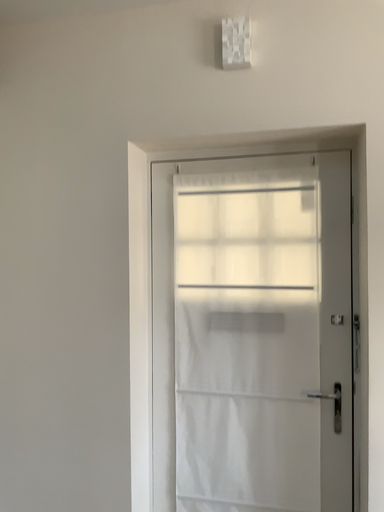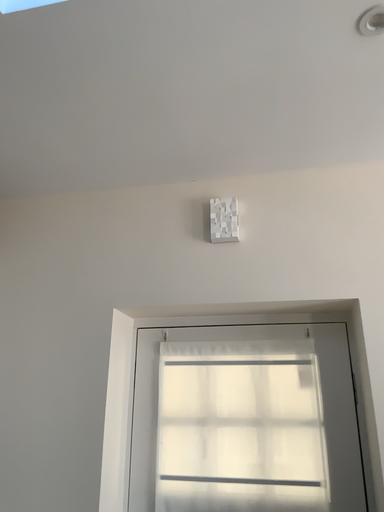
Question: How did the camera likely rotate when shooting the video?

Choices:
 (A) rotated downward
 (B) rotated upward

Answer: (B)